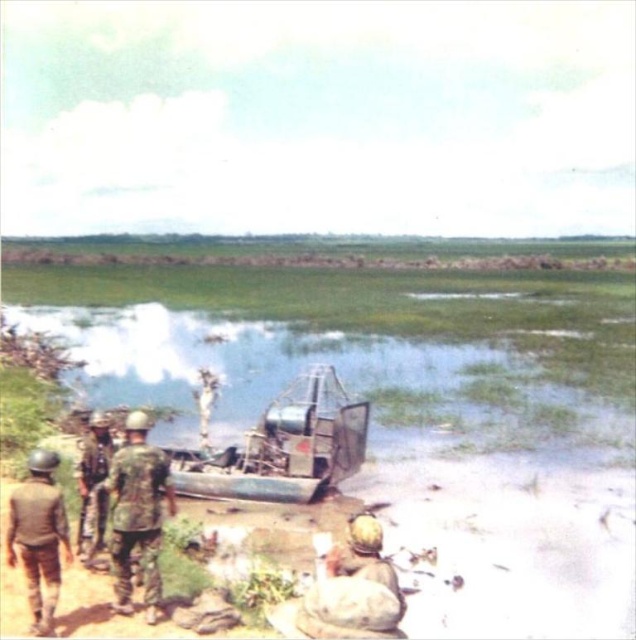
Between camouflage fabric helmet at lower right and camouflage fabric helmet at left, which one appears on the right side from the viewer's perspective?

camouflage fabric helmet at lower right

Between point (343, 580) and point (90, 481), which one is positioned behind?

The point (90, 481) is behind.

Does point (357, 621) lie in front of point (85, 513)?

Yes, it is.

Find the location of a particular element. camouflage fabric helmet at lower right is located at coordinates (354, 588).

Does green grassy water at center have a lesser width compared to camouflage fabric helmet at lower left?

No, green grassy water at center is not thinner than camouflage fabric helmet at lower left.

Measure the distance between green grassy water at center and camouflage fabric helmet at lower left.

They are 22.06 meters apart.

Find the location of a particular element. green grassy water at center is located at coordinates (342, 380).

Is green grassy water at center shorter than camouflage fabric uniform at left?

Incorrect, green grassy water at center's height does not fall short of camouflage fabric uniform at left's.

Between green grassy water at center and camouflage fabric uniform at left, which one has less height?

camouflage fabric uniform at left is shorter.

What do you see at coordinates (342, 380) in the screenshot? I see `green grassy water at center` at bounding box center [342, 380].

You are a GUI agent. You are given a task and a screenshot of the screen. Output one action in this format:
    pyautogui.click(x=<x>, y=<y>)
    Task: Click on the green grassy water at center
    This screenshot has width=636, height=640.
    Given the screenshot: What is the action you would take?
    pyautogui.click(x=342, y=380)